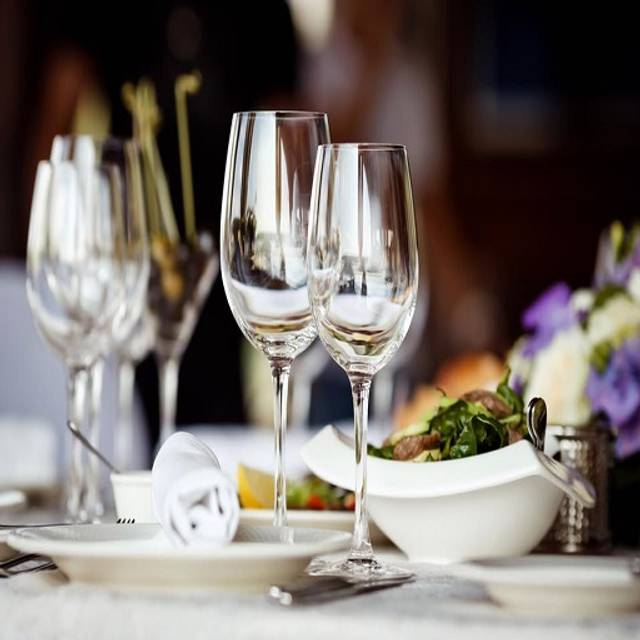
In order to click on bowl in this screenshot , I will do `click(444, 508)`.